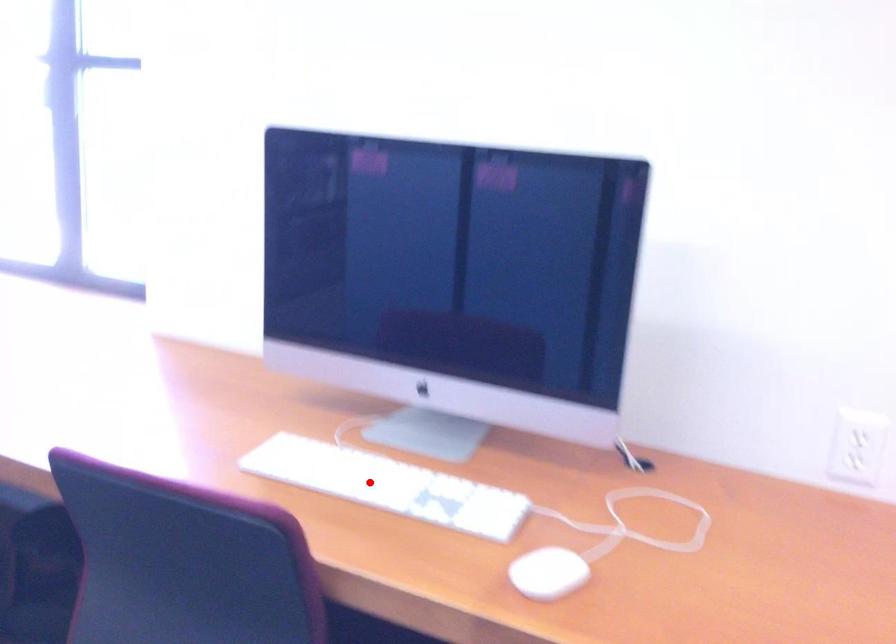
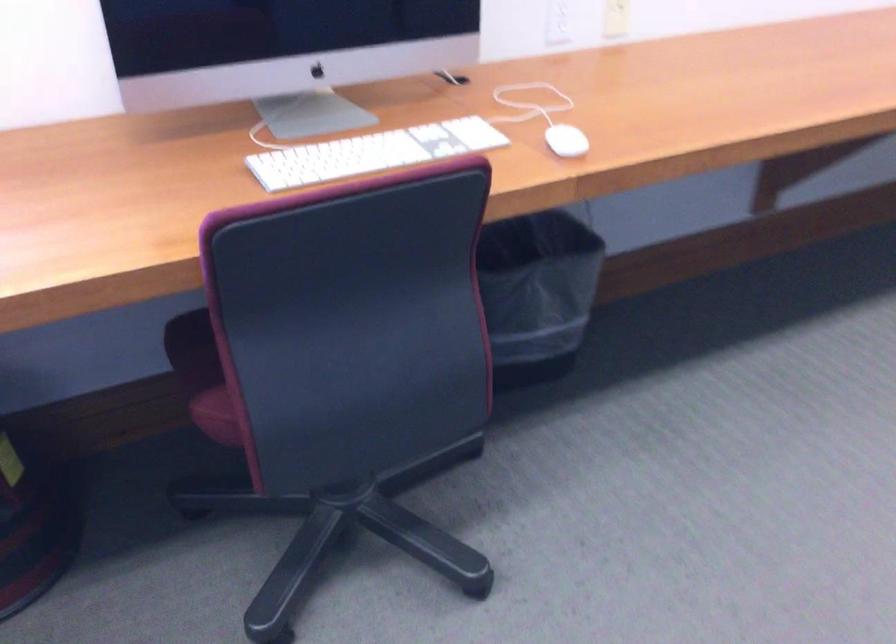
In the second image, find the point that corresponds to the highlighted location in the first image.

(372, 153)